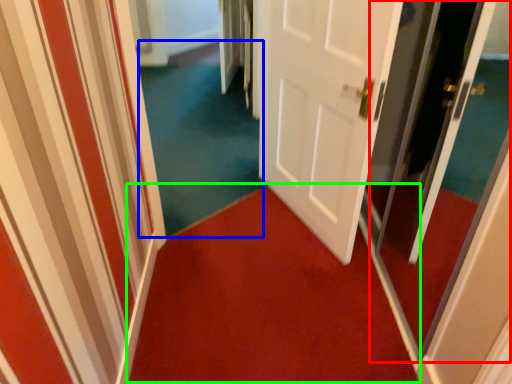
Question: Based on their relative distances, which object is farther from screen door (highlighted by a red box)? Choose from plain (highlighted by a blue box) and doormat (highlighted by a green box).

Choices:
 (A) plain
 (B) doormat

Answer: (A)